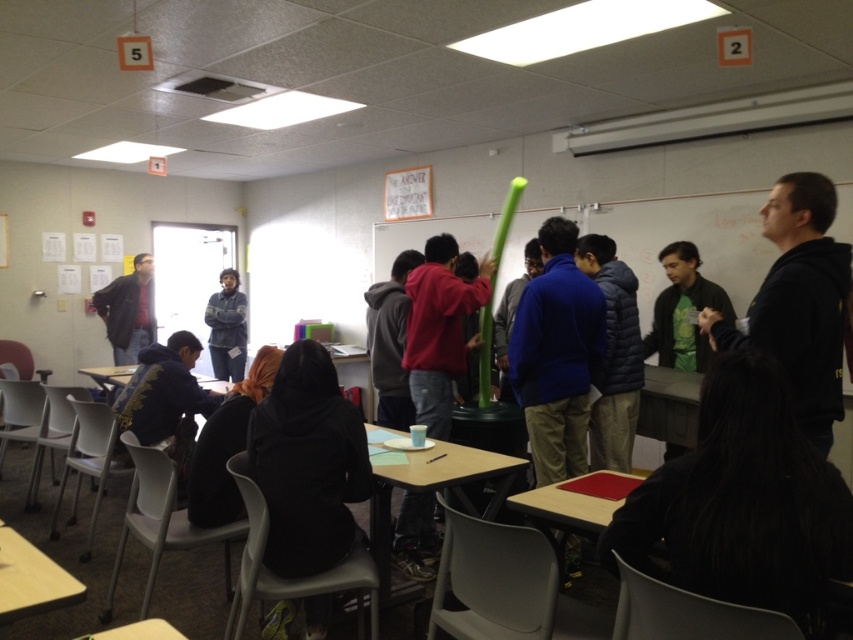
In the scene shown: Between wooden table at lower left and denim jacket at left, which one appears on the right side from the viewer's perspective?

wooden table at lower left

Is wooden table at lower left below denim jacket at left?

Yes, wooden table at lower left is below denim jacket at left.

Find the location of a particular element. wooden table at lower left is located at coordinates (32, 579).

The image size is (853, 640). In order to click on wooden table at lower left in this screenshot , I will do `click(32, 579)`.

Does wooden table at center lie in front of wooden table at lower left?

No.

The image size is (853, 640). What are the coordinates of `wooden table at center` in the screenshot? It's located at (431, 492).

Measure the distance between wooden table at center and camera.

The distance of wooden table at center from camera is 7.87 feet.

Identify the location of wooden table at center. Image resolution: width=853 pixels, height=640 pixels. (431, 492).

Is point (724, 195) behind point (450, 461)?

That is True.

Who is positioned more to the left, green foam pole at center or wooden table at center?

wooden table at center

This screenshot has width=853, height=640. What do you see at coordinates (665, 241) in the screenshot?
I see `green foam pole at center` at bounding box center [665, 241].

Locate an element on the screen. The height and width of the screenshot is (640, 853). green foam pole at center is located at coordinates (665, 241).